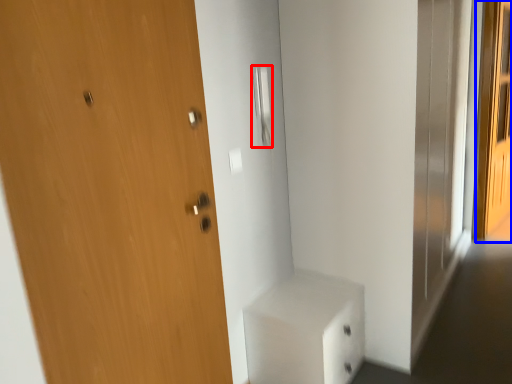
Question: Among these objects, which one is nearest to the camera, door handle (highlighted by a red box) or screen door (highlighted by a blue box)?

Choices:
 (A) door handle
 (B) screen door

Answer: (A)